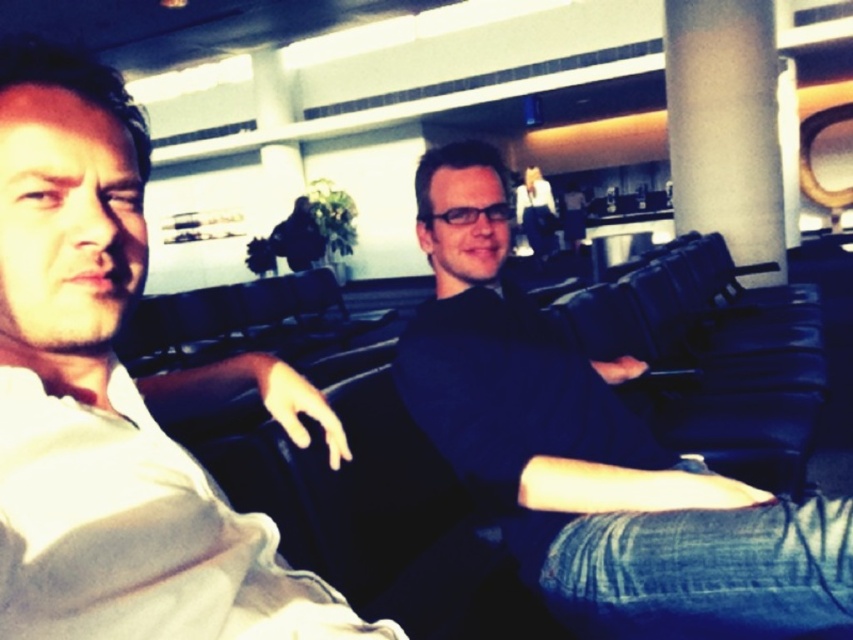
You are standing in the airport lounge and want to reach the point marked as point (117,460). If your stride length is 24 inches per step, how many steps do you need to take to reach that point?

The point (117,460) is 24.33 inches away from you. Since each step covers 24 inches, you would need to take 1 step to reach it, as 24 inches is just slightly less than the required distance, but you can adjust your last step to cover the remaining 0.33 inches.

You are standing in the airport lounge and want to locate the white cotton shirt at left. According to the coordinates provided, where exactly would you find it?

The white cotton shirt at left is located at the coordinates point (119, 401).

You are a photographer standing in the airport lounge. You want to take a photo of the white cotton shirt at left and the white matte pillar at center so that both are clearly visible. Which object should you position closer to the camera to ensure both are in focus?

The white cotton shirt at left is positioned on the left side of the white matte pillar at center. To ensure both are in focus, position the white cotton shirt at left closer to the camera since it is already on the left side, allowing the pillar to be in the same focal plane.